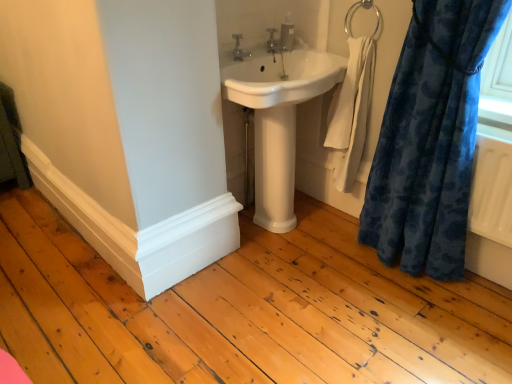
Measure the distance between point (349, 152) and camera.

1.93 meters.

Identify the location of white cotton towel at right. (351, 112).

Where is `silver metallic tap at upper center, positioned as the second tap in back-to-front order`? The image size is (512, 384). silver metallic tap at upper center, positioned as the second tap in back-to-front order is located at coordinates (239, 49).

What do you see at coordinates (272, 41) in the screenshot?
I see `matte silver faucet at upper center, the second tap positioned from the front` at bounding box center [272, 41].

From the picture: In order to face silver metallic towel bar at upper right, should I rotate leftwards or rightwards?

You should rotate right by 13.755 degrees.

What is the approximate width of white glossy pedestal at center?

7.91 inches.

Find the location of `velvety blue curtain at right`. velvety blue curtain at right is located at coordinates (430, 139).

Does silver metallic tap at upper center, which appears as the second tap when viewed from the right, touch white glossy sink at center?

No, silver metallic tap at upper center, which appears as the second tap when viewed from the right, is not next to white glossy sink at center.

In terms of width, does silver metallic tap at upper center, the 1th tap when ordered from left to right, look wider or thinner when compared to white glossy sink at center?

Considering their sizes, silver metallic tap at upper center, the 1th tap when ordered from left to right, looks slimmer than white glossy sink at center.

What's the angular difference between silver metallic tap at upper center, positioned as the second tap in back-to-front order, and white glossy sink at center's facing directions?

0.723 degrees.

Considering the relative sizes of silver metallic tap at upper center, which is the 1th tap from front to back, and white glossy sink at center in the image provided, is silver metallic tap at upper center, which is the 1th tap from front to back, smaller than white glossy sink at center?

Yes, silver metallic tap at upper center, which is the 1th tap from front to back, is smaller than white glossy sink at center.

Is white glossy pedestal at center far from silver metallic tap at upper center, positioned as the second tap in back-to-front order?

No.

From a real-world perspective, is white glossy pedestal at center physically below silver metallic tap at upper center, which is the 1th tap from front to back?

Yes, from a real-world perspective, white glossy pedestal at center is under silver metallic tap at upper center, which is the 1th tap from front to back.

Does point (262, 109) lie in front of point (234, 57)?

That is True.

From the image's perspective, is white glossy pedestal at center above or below silver metallic tap at upper center, the 1th tap when ordered from left to right?

Based on their image positions, white glossy pedestal at center is located beneath silver metallic tap at upper center, the 1th tap when ordered from left to right.

Is silver metallic tap at upper center, which appears as the second tap when viewed from the right, at the back of satin silver soap dispenser at upper center?

satin silver soap dispenser at upper center is not turned away from silver metallic tap at upper center, which appears as the second tap when viewed from the right.

Can you confirm if satin silver soap dispenser at upper center is taller than silver metallic tap at upper center, which is the 1th tap from front to back?

Yes.

Which is more to the left, satin silver soap dispenser at upper center or silver metallic tap at upper center, positioned as the second tap in back-to-front order?

From the viewer's perspective, silver metallic tap at upper center, positioned as the second tap in back-to-front order, appears more on the left side.

From a real-world perspective, is satin silver soap dispenser at upper center below silver metallic tap at upper center, which is the 1th tap from front to back?

Incorrect, from a real-world perspective, satin silver soap dispenser at upper center is higher than silver metallic tap at upper center, which is the 1th tap from front to back.

Is white glossy pedestal at center touching white glossy sink at center?

They are not placed beside each other.

From a real-world perspective, which is physically below, white glossy pedestal at center or white glossy sink at center?

white glossy pedestal at center.

Is white glossy pedestal at center not within white glossy sink at center?

Yes, white glossy pedestal at center is not within white glossy sink at center.

Based on the photo, is silver metallic towel bar at upper right to the left of matte silver faucet at upper center, which ranks as the 1th tap in back-to-front order, from the viewer's perspective?

Incorrect, silver metallic towel bar at upper right is not on the left side of matte silver faucet at upper center, which ranks as the 1th tap in back-to-front order.

From the image's perspective, is silver metallic towel bar at upper right below matte silver faucet at upper center, which ranks as the 1th tap in right-to-left order?

No.

Is silver metallic towel bar at upper right completely or partially outside of matte silver faucet at upper center, the second tap from the left?

Yes, silver metallic towel bar at upper right is not within matte silver faucet at upper center, the second tap from the left.

I want to click on the 2nd tap behind the white glossy sink at center, counting from the anchor's position, so coord(272,41).

Which of these two, white glossy sink at center or matte silver faucet at upper center, which ranks as the 1th tap in right-to-left order, is smaller?

matte silver faucet at upper center, which ranks as the 1th tap in right-to-left order, is smaller.

Which is farther from the camera, (315,64) or (273,41)?

Point (315,64)

From a real-world perspective, is white glossy sink at center beneath matte silver faucet at upper center, which ranks as the 1th tap in right-to-left order?

Correct, in the physical world, white glossy sink at center is lower than matte silver faucet at upper center, which ranks as the 1th tap in right-to-left order.

Looking at this image, considering the sizes of objects silver metallic towel bar at upper right and white glossy sink at center in the image provided, who is thinner, silver metallic towel bar at upper right or white glossy sink at center?

With smaller width is silver metallic towel bar at upper right.

From a real-world perspective, who is located higher, silver metallic towel bar at upper right or white glossy sink at center?

silver metallic towel bar at upper right, from a real-world perspective.

Is white glossy sink at center inside silver metallic towel bar at upper right?

Actually, white glossy sink at center is outside silver metallic towel bar at upper right.

Which tap is the 2nd one when counting from the left side of the white glossy sink at center? Please provide its 2D coordinates.

[(239, 49)]

This screenshot has width=512, height=384. What are the coordinates of `tap that is the 1st one when counting upward from the white glossy pedestal at center (from the image's perspective)` in the screenshot? It's located at (239, 49).

Estimate the real-world distances between objects in this image. Which object is closer to satin silver soap dispenser at upper center, white glossy pedestal at center or silver metallic tap at upper center, which is the 1th tap from front to back?

silver metallic tap at upper center, which is the 1th tap from front to back.

Based on their spatial positions, is satin silver soap dispenser at upper center or white glossy sink at center closer to matte silver faucet at upper center, which ranks as the 1th tap in right-to-left order?

satin silver soap dispenser at upper center is positioned closer to the anchor matte silver faucet at upper center, which ranks as the 1th tap in right-to-left order.

Estimate the real-world distances between objects in this image. Which object is closer to silver metallic towel bar at upper right, velvety blue curtain at right or matte silver faucet at upper center, which ranks as the 1th tap in back-to-front order?

matte silver faucet at upper center, which ranks as the 1th tap in back-to-front order, lies closer to silver metallic towel bar at upper right than the other object.

Based on their spatial positions, is velvety blue curtain at right or satin silver soap dispenser at upper center further from white cotton towel at right?

satin silver soap dispenser at upper center lies further to white cotton towel at right than the other object.

From the image, which object appears to be nearer to white glossy pedestal at center, white glossy sink at center or silver metallic towel bar at upper right?

Among the two, white glossy sink at center is located nearer to white glossy pedestal at center.

Considering their positions, is matte silver faucet at upper center, the second tap positioned from the front, positioned further to white glossy pedestal at center than satin silver soap dispenser at upper center?

satin silver soap dispenser at upper center lies further to white glossy pedestal at center than the other object.

From the picture: Based on their spatial positions, is silver metallic tap at upper center, which appears as the second tap when viewed from the right, or silver metallic towel bar at upper right closer to white glossy pedestal at center?

silver metallic tap at upper center, which appears as the second tap when viewed from the right, is closer to white glossy pedestal at center.

From the image, which object appears to be nearer to velvety blue curtain at right, white cotton towel at right or white glossy sink at center?

white cotton towel at right is positioned closer to the anchor velvety blue curtain at right.

At what (x,y) coordinates should I click in order to perform the action: click on sink located between velvety blue curtain at right and white glossy pedestal at center in the depth direction. Please return your answer as a coordinate pair (x, y). The image size is (512, 384). Looking at the image, I should click on (x=281, y=78).

Where is `sink that lies between silver metallic tap at upper center, which appears as the second tap when viewed from the right, and white glossy pedestal at center from top to bottom`? sink that lies between silver metallic tap at upper center, which appears as the second tap when viewed from the right, and white glossy pedestal at center from top to bottom is located at coordinates (281, 78).

At what (x,y) coordinates should I click in order to perform the action: click on toiletry between silver metallic tap at upper center, the 1th tap when ordered from left to right, and silver metallic towel bar at upper right. Please return your answer as a coordinate pair (x, y). Looking at the image, I should click on (287, 33).

Find the location of a particular element. This screenshot has width=512, height=384. tap situated between silver metallic tap at upper center, positioned as the second tap in back-to-front order, and satin silver soap dispenser at upper center from left to right is located at coordinates (272, 41).